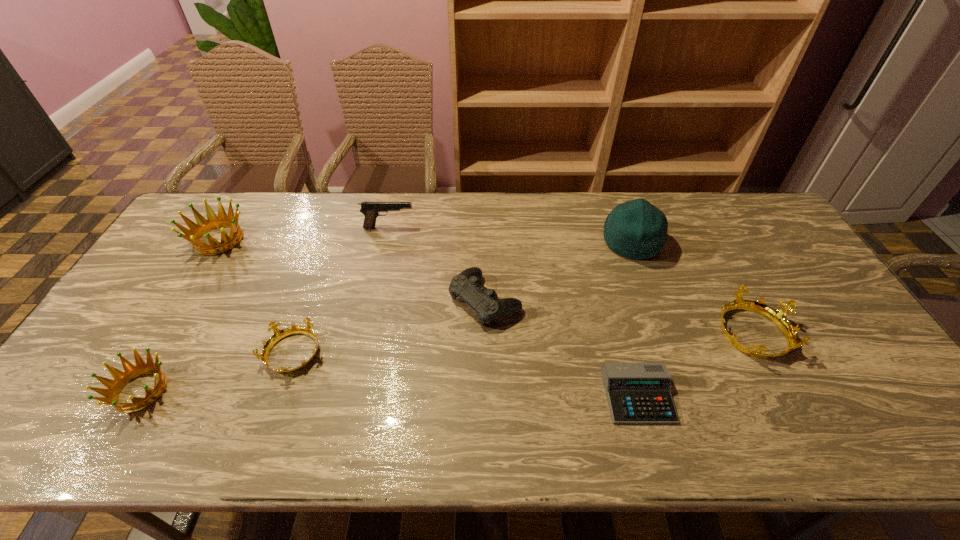
The width and height of the screenshot is (960, 540). Identify the location of free spot between the tallest crown and the seventh tallest object. (256, 297).

The height and width of the screenshot is (540, 960). Find the location of `object that is the sixth nearest to the tallest object`. object that is the sixth nearest to the tallest object is located at coordinates (203, 226).

You are a GUI agent. You are given a task and a screenshot of the screen. Output one action in this format:
    pyautogui.click(x=<x>, y=<y>)
    Task: Click on the object that is the fourth closest to the black pistol
    This screenshot has height=540, width=960.
    Given the screenshot: What is the action you would take?
    pyautogui.click(x=636, y=229)

At what (x,y) coordinates should I click in order to perform the action: click on crown that stands as the closest to the calculator. Please return your answer as a coordinate pair (x, y). Image resolution: width=960 pixels, height=540 pixels. Looking at the image, I should click on (778, 317).

You are a GUI agent. You are given a task and a screenshot of the screen. Output one action in this format:
    pyautogui.click(x=<x>, y=<y>)
    Task: Click on the crown that stands as the third closest to the farther golden crown
    The image size is (960, 540).
    Given the screenshot: What is the action you would take?
    pyautogui.click(x=778, y=317)